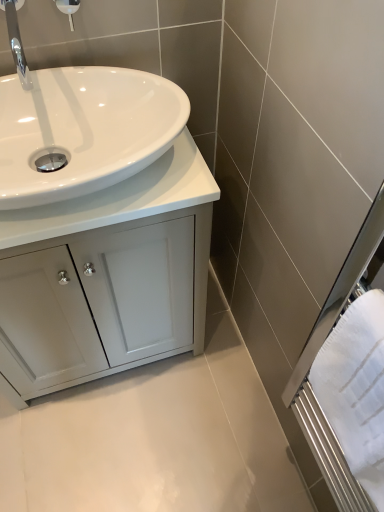
What is the approximate width of white glossy shower head at upper left?

white glossy shower head at upper left is 1.75 inches wide.

What do you see at coordinates (356, 389) in the screenshot? This screenshot has width=384, height=512. I see `white textured towel at right` at bounding box center [356, 389].

Where is `white glossy shower head at upper left`? The width and height of the screenshot is (384, 512). white glossy shower head at upper left is located at coordinates (68, 9).

The height and width of the screenshot is (512, 384). I want to click on bathroom cabinet on the left of white glossy shower head at upper left, so click(x=108, y=246).

Do you think white glossy cabinet at lower left is within white glossy shower head at upper left, or outside of it?

white glossy cabinet at lower left is spatially situated outside white glossy shower head at upper left.

Between white glossy cabinet at lower left and white glossy shower head at upper left, which one has less height?

Standing shorter between the two is white glossy shower head at upper left.

Which of these two, white glossy cabinet at lower left or white glossy shower head at upper left, is bigger?

white glossy cabinet at lower left is bigger.

Who is taller, white glossy cabinet at lower left or white textured towel at right?

With more height is white glossy cabinet at lower left.

Which is more to the right, white glossy cabinet at lower left or white textured towel at right?

white textured towel at right.

Is white glossy cabinet at lower left not within white textured towel at right?

That's correct, white glossy cabinet at lower left is outside of white textured towel at right.

What's the angular difference between white glossy cabinet at lower left and white textured towel at right's facing directions?

They differ by 89.3 degrees in their facing directions.

Considering the relative sizes of white glossy shower head at upper left and white glossy countertop at center in the image provided, is white glossy shower head at upper left shorter than white glossy countertop at center?

Indeed, white glossy shower head at upper left has a lesser height compared to white glossy countertop at center.

At what (x,y) coordinates should I click in order to perform the action: click on shower on the left of white glossy countertop at center. Please return your answer as a coordinate pair (x, y). The image size is (384, 512). Looking at the image, I should click on (68, 9).

Is white glossy shower head at upper left oriented away from white glossy countertop at center?

No, white glossy shower head at upper left's orientation is not away from white glossy countertop at center.

Does white glossy shower head at upper left appear on the left side of white glossy countertop at center?

Indeed, white glossy shower head at upper left is positioned on the left side of white glossy countertop at center.

In the scene shown: Are white glossy shower head at upper left and white textured towel at right far apart?

They are positioned close to each other.

Who is taller, white glossy shower head at upper left or white textured towel at right?

With more height is white textured towel at right.

Is white glossy shower head at upper left situated inside white textured towel at right or outside?

white glossy shower head at upper left cannot be found inside white textured towel at right.

Is white glossy shower head at upper left looking in the opposite direction of white textured towel at right?

No, white glossy shower head at upper left is not facing away from white textured towel at right.

Would you say white textured towel at right is inside or outside white glossy cabinet at lower left?

white textured towel at right is located beyond the bounds of white glossy cabinet at lower left.

In the image, there is a white glossy cabinet at lower left. Identify the location of bath towel below it (from the image's perspective). This screenshot has height=512, width=384. pyautogui.click(x=356, y=389).

In terms of width, does white textured towel at right look wider or thinner when compared to white glossy cabinet at lower left?

white textured towel at right is thinner than white glossy cabinet at lower left.

Which object is closer to the camera, white textured towel at right or white glossy cabinet at lower left?

white textured towel at right.

Is polished chrome faucet at upper left next to white glossy shower head at upper left?

No, polished chrome faucet at upper left is not with white glossy shower head at upper left.

Which of these two, polished chrome faucet at upper left or white glossy shower head at upper left, is wider?

polished chrome faucet at upper left.

Looking at the image, does polished chrome faucet at upper left seem bigger or smaller compared to white glossy shower head at upper left?

polished chrome faucet at upper left is bigger than white glossy shower head at upper left.

Which of these two, polished chrome faucet at upper left or white glossy shower head at upper left, stands taller?

Standing taller between the two is white glossy shower head at upper left.

From a real-world perspective, between white glossy cabinet at lower left and white glossy countertop at center, who is vertically lower?

white glossy cabinet at lower left.

Is white glossy countertop at center at the back of white glossy cabinet at lower left?

No, white glossy cabinet at lower left's orientation is not away from white glossy countertop at center.

Is white glossy cabinet at lower left wider or thinner than white glossy countertop at center?

In the image, white glossy cabinet at lower left appears to be wider than white glossy countertop at center.

Where is `shower above the white glossy cabinet at lower left (from a real-world perspective)`? shower above the white glossy cabinet at lower left (from a real-world perspective) is located at coordinates 68,9.

I want to click on bathroom cabinet lying behind the white textured towel at right, so click(x=108, y=246).

Estimate the real-world distances between objects in this image. Which object is further from polished chrome faucet at upper left, white glossy shower head at upper left or white glossy countertop at center?

white glossy countertop at center is positioned further to the anchor polished chrome faucet at upper left.

Looking at the image, which one is located closer to white glossy countertop at center, polished chrome faucet at upper left or white textured towel at right?

The object closer to white glossy countertop at center is polished chrome faucet at upper left.

Based on the photo, when comparing their distances from polished chrome faucet at upper left, does white textured towel at right or white glossy cabinet at lower left seem further?

white textured towel at right.

When comparing their distances from white glossy cabinet at lower left, does white glossy shower head at upper left or white textured towel at right seem closer?

Among the two, white textured towel at right is located nearer to white glossy cabinet at lower left.

From the image, which object appears to be farther from white glossy shower head at upper left, white glossy cabinet at lower left or white glossy countertop at center?

white glossy cabinet at lower left is further to white glossy shower head at upper left.

When comparing their distances from polished chrome faucet at upper left, does white textured towel at right or white glossy countertop at center seem further?

white textured towel at right lies further to polished chrome faucet at upper left than the other object.

Considering their positions, is white glossy countertop at center positioned further to polished chrome faucet at upper left than white glossy shower head at upper left?

The object further to polished chrome faucet at upper left is white glossy countertop at center.

Consider the image. When comparing their distances from white glossy cabinet at lower left, does polished chrome faucet at upper left or white glossy countertop at center seem further?

polished chrome faucet at upper left.

This screenshot has width=384, height=512. Identify the location of counter top between polished chrome faucet at upper left and white glossy cabinet at lower left from top to bottom. (119, 199).

What are the coordinates of `bathroom cabinet between white glossy shower head at upper left and white textured towel at right vertically` in the screenshot? It's located at (108, 246).

Locate an element on the screen. The width and height of the screenshot is (384, 512). bathroom cabinet between polished chrome faucet at upper left and white textured towel at right in the horizontal direction is located at coordinates (108, 246).

Image resolution: width=384 pixels, height=512 pixels. I want to click on counter top between white glossy shower head at upper left and white glossy cabinet at lower left from top to bottom, so click(119, 199).